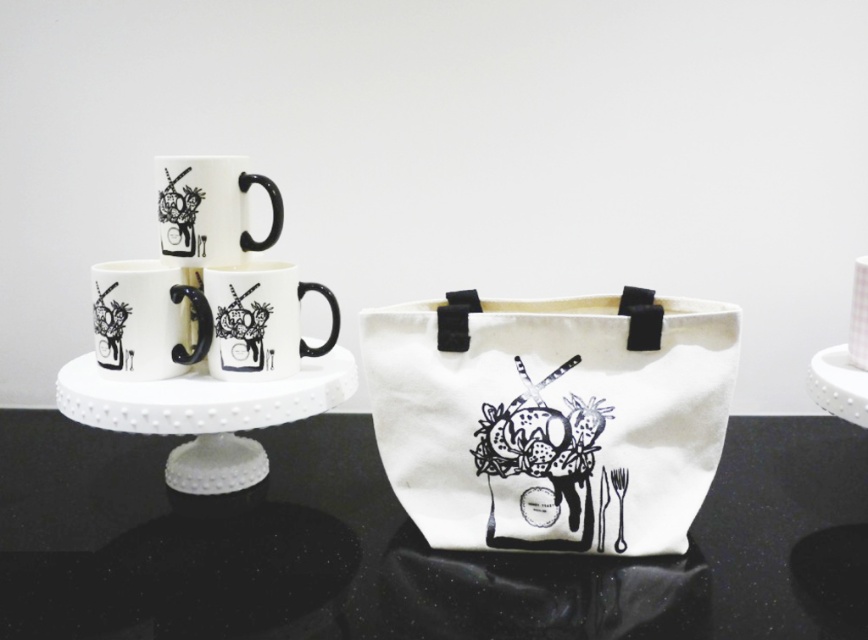
Based on the photo, is matte white mug at left to the left of white matte coffee cup at center from the viewer's perspective?

Indeed, matte white mug at left is positioned on the left side of white matte coffee cup at center.

Between point (155, 344) and point (217, 189), which one is positioned in front?

Point (155, 344) is more forward.

Find the location of a particular element. This screenshot has width=868, height=640. matte white mug at left is located at coordinates (146, 321).

Who is more forward, [412,483] or [297,320]?

Point [412,483] is in front.

At what (x,y) coordinates should I click in order to perform the action: click on white canvas tote at center. Please return your answer as a coordinate pair (x, y). Looking at the image, I should click on (551, 417).

Identify the location of white canvas tote at center. (551, 417).

Find the location of a particular element. white canvas tote at center is located at coordinates point(551,417).

Is matte white mug at left wider than white matte mug at center?

No.

From the picture: Does matte white mug at left have a smaller size compared to white matte mug at center?

Yes, matte white mug at left is smaller than white matte mug at center.

Which is in front, point (110, 342) or point (253, 358)?

Positioned in front is point (110, 342).

Image resolution: width=868 pixels, height=640 pixels. In order to click on matte white mug at left in this screenshot , I will do `click(146, 321)`.